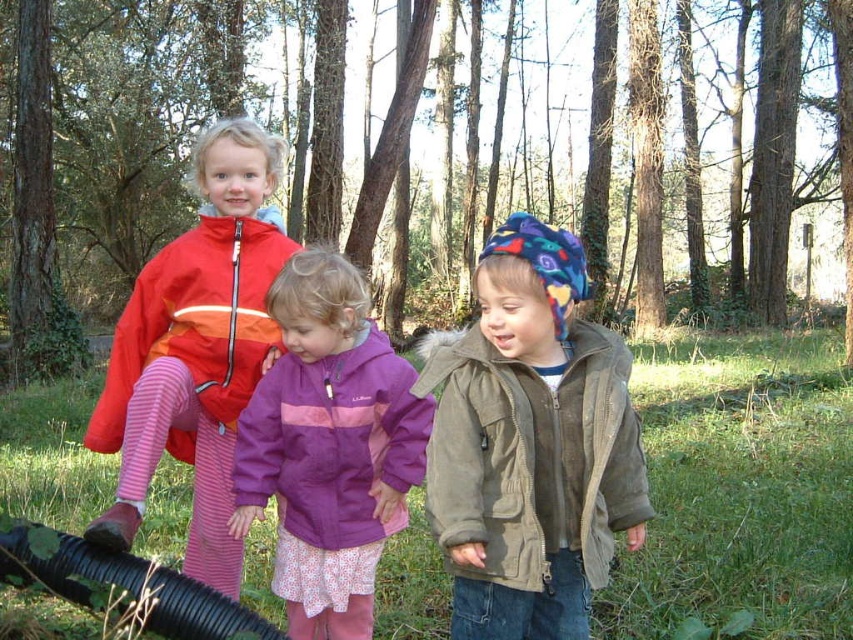
The two children at the center are standing close. If a parent wants to take a photo that includes both the purple matte jacket at center and the suede jacket at center without any part of them being cut off, what is the minimum distance the parent should stand from the children?

The purple matte jacket at center and the suede jacket at center are 24.15 inches apart from each other. To ensure both are fully captured in the photo, the parent should stand at least 24.15 inches away from the closest child to allow the camera to frame both jackets without cropping.

Looking at this image, you are standing in the wooded area and see the three children. The middle child is wearing a purple jacket with a pink stripe across the chest. The child on the left is wearing a bright red jacket with orange accents. The third child is wearing a suede jacket at center. Which child is closest to you?

The suede jacket at center is closest to the viewer as it is only 7.11 feet away, making it the nearest among the three children.

You are a photographer trying to capture a group photo of the matte red jacket at left and the purple matte jacket at center. The camera you are using has a minimum focusing distance of 18 inches. Will you be able to take a clear photo of both jackets without moving them?

The distance between the matte red jacket at left and the purple matte jacket at center is 17.22 inches. Since the camera requires a minimum focusing distance of 18 inches, the photographer will need to move the jackets slightly closer to the camera or have the children move closer to each other to ensure both are in focus.